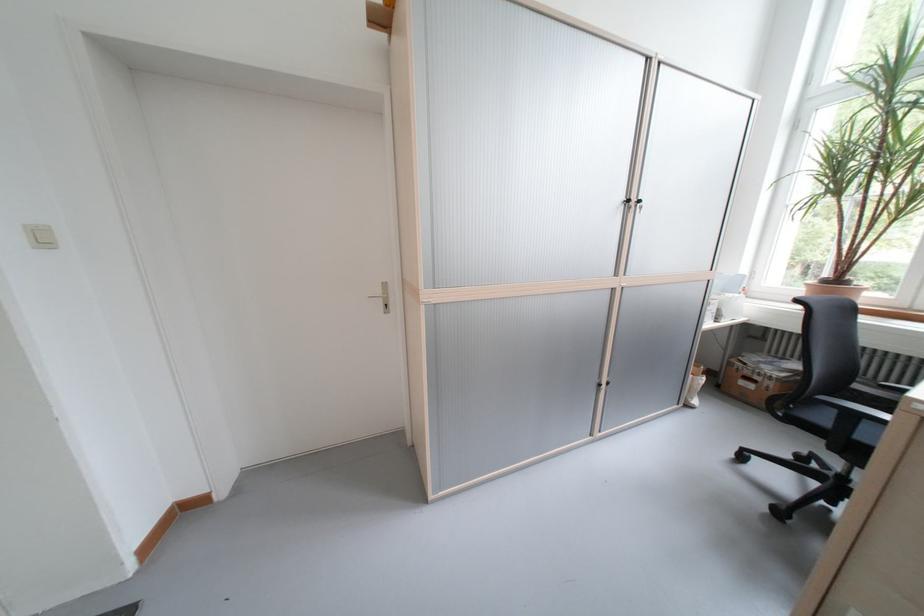
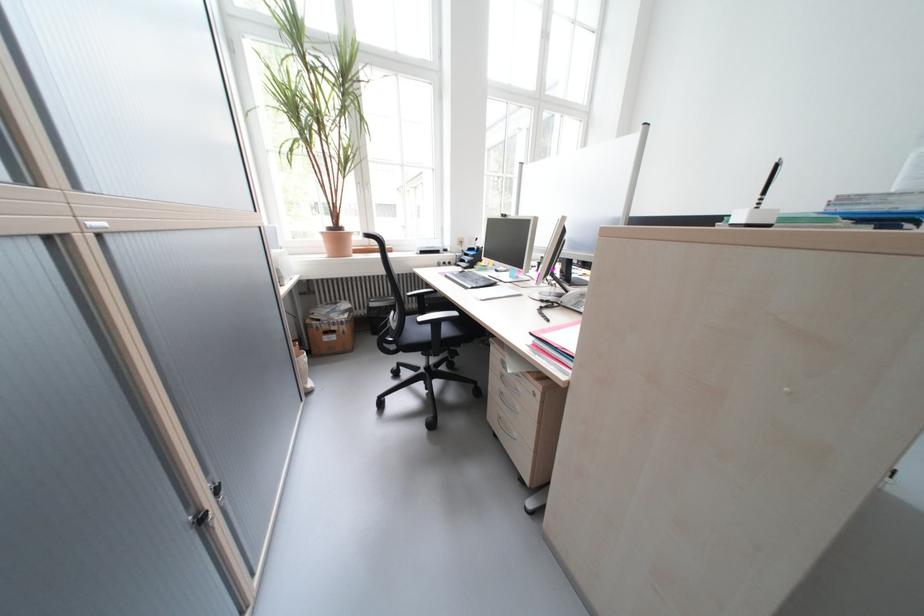
Where in the second image is the point corresponding to the point at 834,283 from the first image?

(339, 231)